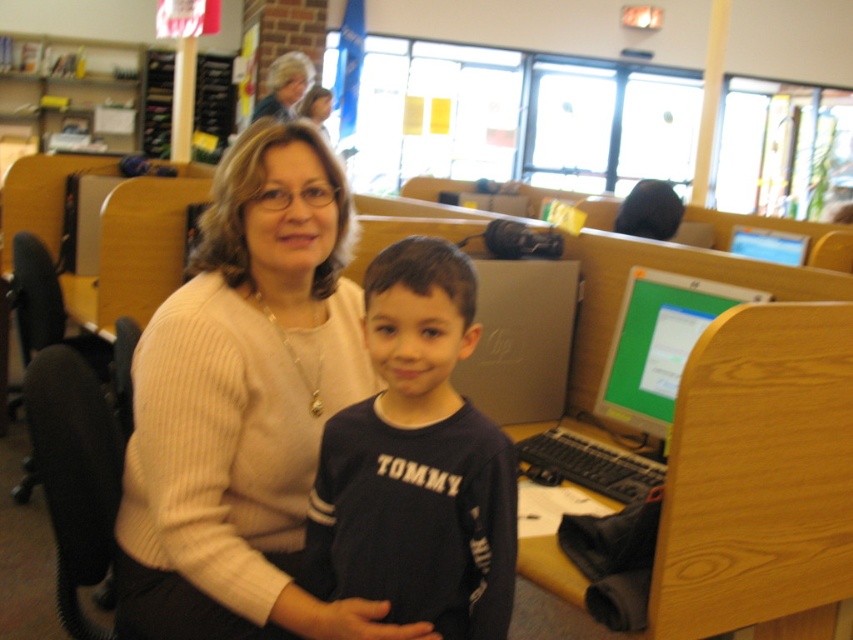
Is light beige sweater at center taller than green glossy monitor at upper right?

Yes.

Locate an element on the screen. light beige sweater at center is located at coordinates (244, 404).

The width and height of the screenshot is (853, 640). Identify the location of light beige sweater at center. (244, 404).

You are a GUI agent. You are given a task and a screenshot of the screen. Output one action in this format:
    pyautogui.click(x=<x>, y=<y>)
    Task: Click on the light beige sweater at center
    This screenshot has height=640, width=853.
    Given the screenshot: What is the action you would take?
    pyautogui.click(x=244, y=404)

Does dark blue jersey at center appear on the right side of silver metallic monitor at right?

No, dark blue jersey at center is not to the right of silver metallic monitor at right.

Based on the photo, which is above, dark blue jersey at center or silver metallic monitor at right?

silver metallic monitor at right is above.

Locate an element on the screen. The height and width of the screenshot is (640, 853). dark blue jersey at center is located at coordinates point(416,461).

Does silver metallic monitor at right have a greater height compared to green glossy monitor at upper right?

Correct, silver metallic monitor at right is much taller as green glossy monitor at upper right.

Is point (654, 296) farther from camera compared to point (802, 236)?

That is False.

Is point (664, 298) behind point (796, 244)?

No, it is in front of (796, 244).

Locate an element on the screen. silver metallic monitor at right is located at coordinates (659, 344).